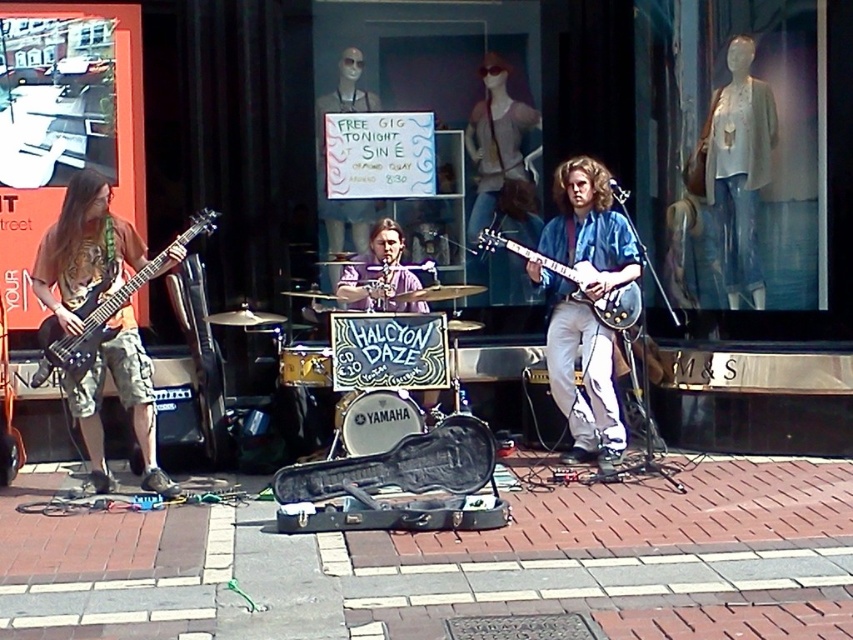
Question: In this image, where is blue glossy guitar at center located relative to light beige fabric jacket at upper right?

Choices:
 (A) above
 (B) below

Answer: (B)

Question: Does matte black guitar at left have a larger size compared to matte black electric guitar at left?

Choices:
 (A) yes
 (B) no

Answer: (A)

Question: Considering the real-world distances, which object is closest to the brick pavement at center?

Choices:
 (A) glossy electric guitar at center
 (B) matte black guitar at left

Answer: (A)

Question: Is brick pavement at center below matte black electric guitar at left?

Choices:
 (A) yes
 (B) no

Answer: (A)

Question: Which point is farther from the camera taking this photo?

Choices:
 (A) (50, 349)
 (B) (589, 218)

Answer: (B)

Question: Which object is closer to the camera taking this photo?

Choices:
 (A) matte black electric guitar at left
 (B) blue glossy guitar at center
 (C) brick pavement at center

Answer: (C)